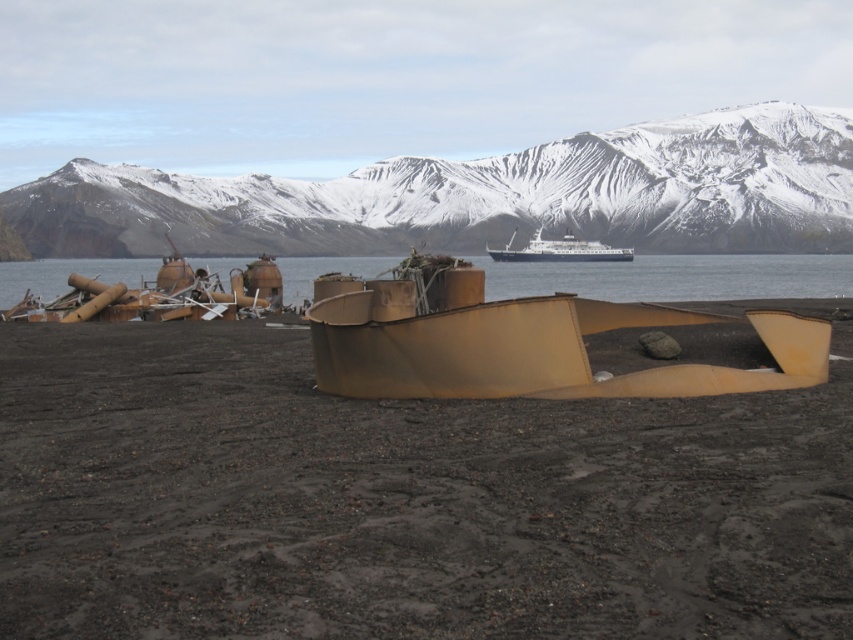
Question: From the image, what is the correct spatial relationship of brown matte water at center in relation to white matte ship at center?

Choices:
 (A) left
 (B) right

Answer: (A)

Question: Which point is farther to the camera?

Choices:
 (A) (811, 259)
 (B) (839, 301)

Answer: (A)

Question: From the image, what is the correct spatial relationship of rusty metallic debris at center in relation to white matte ship at center?

Choices:
 (A) left
 (B) right

Answer: (A)

Question: Which of the following is the farthest from the observer?

Choices:
 (A) (672, 228)
 (B) (610, 248)

Answer: (A)

Question: Can you confirm if rusty metallic debris at center is positioned above rusty metal boat at center?

Choices:
 (A) no
 (B) yes

Answer: (A)

Question: Among these points, which one is farthest from the camera?

Choices:
 (A) (596, 220)
 (B) (601, 282)

Answer: (A)